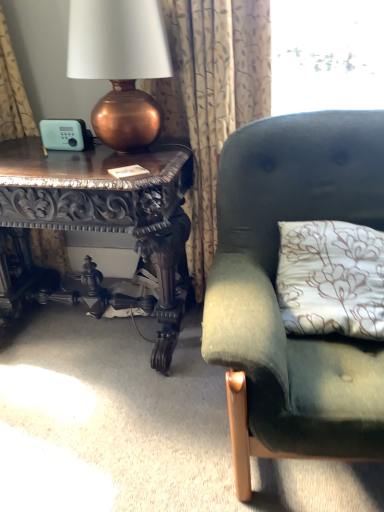
Question: Is patterned fabric curtain at upper left outside velvet green couch at right?

Choices:
 (A) no
 (B) yes

Answer: (B)

Question: From a real-world perspective, is patterned fabric curtain at upper left under velvet green couch at right?

Choices:
 (A) yes
 (B) no

Answer: (B)

Question: Is patterned fabric curtain at upper left touching velvet green couch at right?

Choices:
 (A) yes
 (B) no

Answer: (B)

Question: Is patterned fabric curtain at upper left smaller than velvet green couch at right?

Choices:
 (A) yes
 (B) no

Answer: (A)

Question: Can you confirm if patterned fabric curtain at upper left is shorter than velvet green couch at right?

Choices:
 (A) yes
 (B) no

Answer: (B)

Question: Is the depth of patterned fabric curtain at upper left less than that of velvet green couch at right?

Choices:
 (A) yes
 (B) no

Answer: (B)

Question: Is copper metallic lamp at left closer to camera compared to velvet green couch at right?

Choices:
 (A) no
 (B) yes

Answer: (A)

Question: From a real-world perspective, is copper metallic lamp at left physically above velvet green couch at right?

Choices:
 (A) no
 (B) yes

Answer: (B)

Question: Does copper metallic lamp at left have a lesser height compared to velvet green couch at right?

Choices:
 (A) no
 (B) yes

Answer: (B)

Question: Is copper metallic lamp at left outside of velvet green couch at right?

Choices:
 (A) no
 (B) yes

Answer: (B)

Question: Could you tell me if copper metallic lamp at left is facing velvet green couch at right?

Choices:
 (A) no
 (B) yes

Answer: (A)

Question: Is copper metallic lamp at left not close to velvet green couch at right?

Choices:
 (A) yes
 (B) no

Answer: (B)

Question: Does carved wood table at left have a larger size compared to copper metallic lamp at left?

Choices:
 (A) yes
 (B) no

Answer: (A)